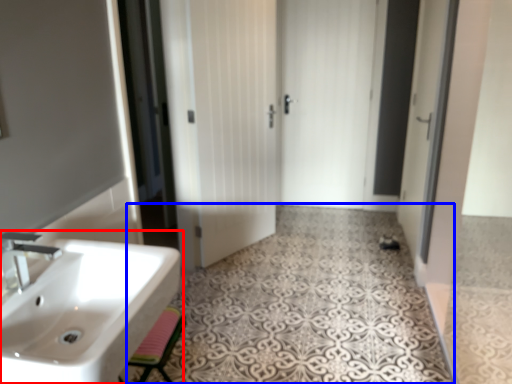
Question: Which point is closer to the camera, sink (highlighted by a red box) or pattern (highlighted by a blue box)?

Choices:
 (A) sink
 (B) pattern

Answer: (A)